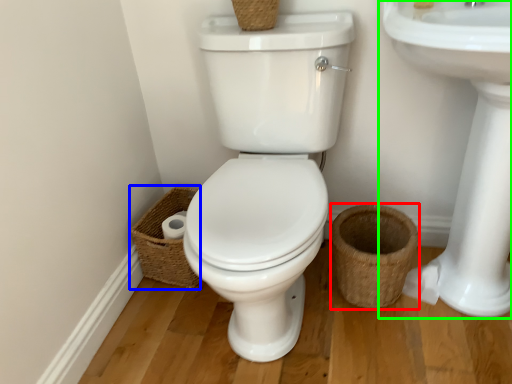
Question: Estimate the real-world distances between objects in this image. Which object is closer to basket (highlighted by a red box), basket (highlighted by a blue box) or sink (highlighted by a green box)?

Choices:
 (A) basket
 (B) sink

Answer: (B)